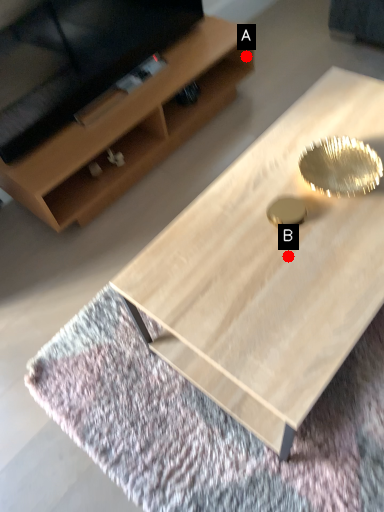
Question: Two points are circled on the image, labeled by A and B beside each circle. Which point appears closest to the camera in this image?

Choices:
 (A) A is closer
 (B) B is closer

Answer: (B)